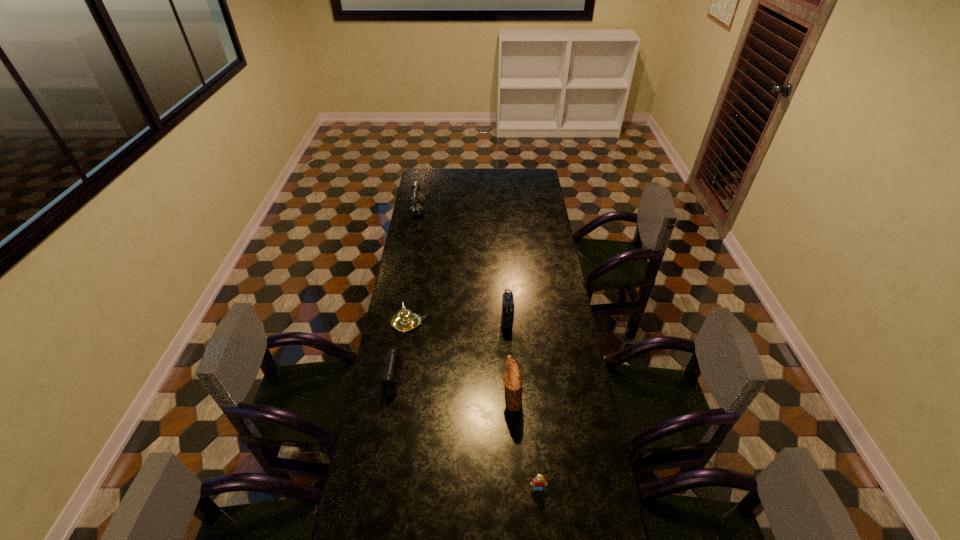
Where is `earphone`? This screenshot has width=960, height=540. earphone is located at coordinates (416, 208).

Image resolution: width=960 pixels, height=540 pixels. Identify the location of the farthest clutch bag. (507, 316).

Where is `the fourth tallest object`? This screenshot has width=960, height=540. the fourth tallest object is located at coordinates coord(404,321).

Locate an element on the screen. The image size is (960, 540). the shortest clutch bag is located at coordinates (391, 370).

Image resolution: width=960 pixels, height=540 pixels. Identify the location of Lego. (539, 482).

The image size is (960, 540). Identify the location of the nearest object. (539, 482).

Find the location of a particular element. vacant space located 0.390m on the ear pads of the farthest object is located at coordinates (493, 211).

Identify the location of free space located 0.120m with the zip open on the farthest clutch bag. This screenshot has width=960, height=540. (509, 355).

The height and width of the screenshot is (540, 960). Identify the location of vacant area situated on the handle side of the candle holder. (517, 323).

Identify the location of vacant space positioned on the front flap of the leftmost clutch bag. (423, 379).